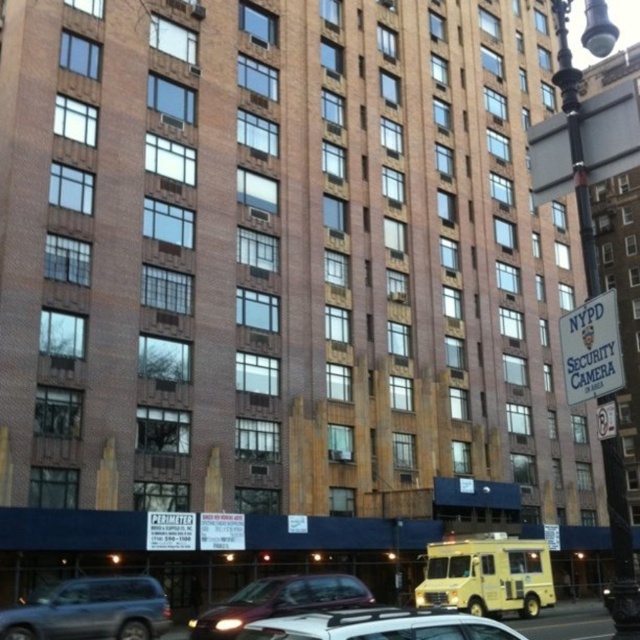
Question: Among these objects, which one is nearest to the camera?

Choices:
 (A) white matte car at lower center
 (B) metallic gray suv at lower left
 (C) black metal lamp post at right

Answer: (A)

Question: Is metallic gray suv at lower left thinner than white plastic nypd security camera at upper right?

Choices:
 (A) no
 (B) yes

Answer: (B)

Question: Observing the image, what is the correct spatial positioning of yellow matte food truck at lower right in reference to metallic gray suv at lower left?

Choices:
 (A) above
 (B) below

Answer: (B)

Question: Does yellow matte food truck at lower right appear on the right side of white matte car at lower center?

Choices:
 (A) no
 (B) yes

Answer: (B)

Question: Which object appears closest to the camera in this image?

Choices:
 (A) metallic gray suv at lower left
 (B) black metal lamp post at right
 (C) white matte car at lower center
 (D) white plastic nypd security camera at upper right

Answer: (C)

Question: Which object appears closest to the camera in this image?

Choices:
 (A) white plastic nypd security camera at upper right
 (B) black metal lamp post at right

Answer: (A)